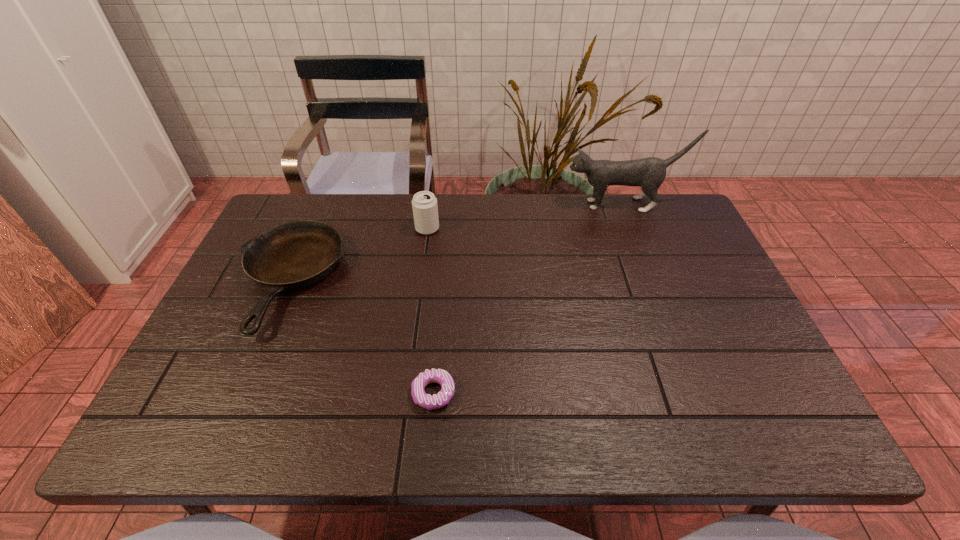
The image size is (960, 540). What are the coordinates of `vacant area that lies between the third shortest object and the frying pan` in the screenshot? It's located at (359, 255).

Find the location of a particular element. unoccupied area between the doughnut and the rightmost object is located at coordinates (528, 299).

The width and height of the screenshot is (960, 540). In order to click on vacant area between the leftmost object and the farthest object in this screenshot , I will do `click(456, 243)`.

You are a GUI agent. You are given a task and a screenshot of the screen. Output one action in this format:
    pyautogui.click(x=<x>, y=<y>)
    Task: Click on the vacant region between the frying pan and the third shortest object
    Image resolution: width=960 pixels, height=540 pixels.
    Given the screenshot: What is the action you would take?
    pyautogui.click(x=359, y=255)

Locate an element on the screen. empty space between the farthest object and the nearest object is located at coordinates (528, 299).

This screenshot has height=540, width=960. I want to click on vacant area that lies between the second tallest object and the shortest object, so click(430, 311).

The width and height of the screenshot is (960, 540). I want to click on vacant area that lies between the shortest object and the farthest object, so click(x=528, y=299).

Find the location of `object that stands as the closest to the second tallest object`. object that stands as the closest to the second tallest object is located at coordinates (294, 255).

The width and height of the screenshot is (960, 540). Identify the location of object that ranks as the closest to the nearest object. (294, 255).

Locate an element on the screen. free space in the image that satisfies the following two spatial constraints: 1. at the face of the farthest object; 2. on the front side of the second tallest object is located at coordinates (632, 228).